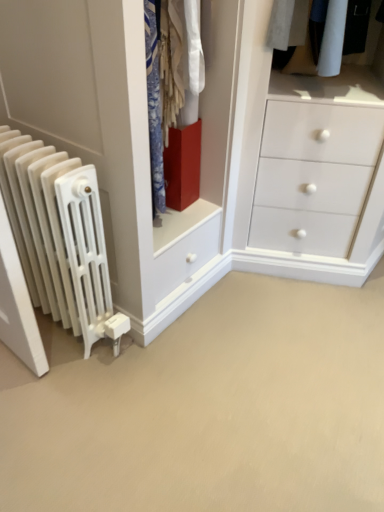
Question: Based on their positions, is white matte radiator at left located to the left or right of matte red cube at center?

Choices:
 (A) left
 (B) right

Answer: (A)

Question: From the image's perspective, is white matte radiator at left above or below matte red cube at center?

Choices:
 (A) above
 (B) below

Answer: (B)

Question: Estimate the real-world distances between objects in this image. Which object is closer to the matte red cube at center?

Choices:
 (A) white matte radiator at left
 (B) white matte radiator at left

Answer: (A)

Question: Which is farther from the white matte radiator at left?

Choices:
 (A) white matte radiator at left
 (B) matte red cube at center

Answer: (A)